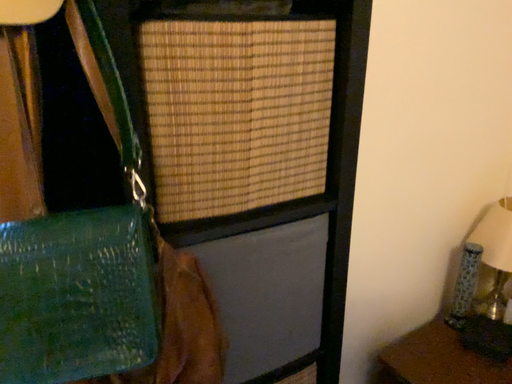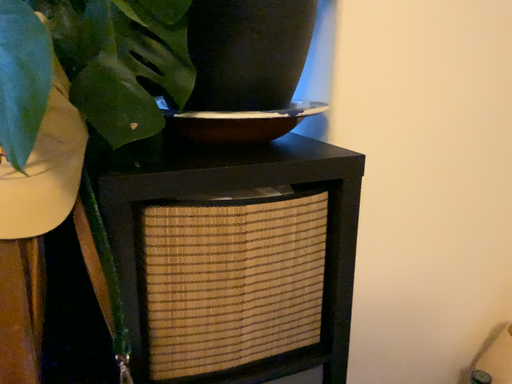
Question: Which way did the camera rotate in the video?

Choices:
 (A) rotated upward
 (B) rotated downward

Answer: (A)